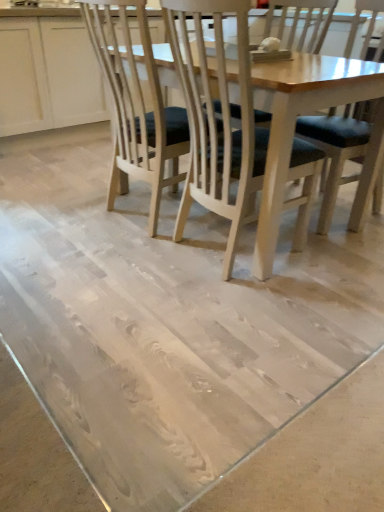
Find the location of a particular element. This screenshot has height=512, width=384. vacant space in front of dark blue fabric chair at center, placed as the second chair when sorted from left to right is located at coordinates (340, 255).